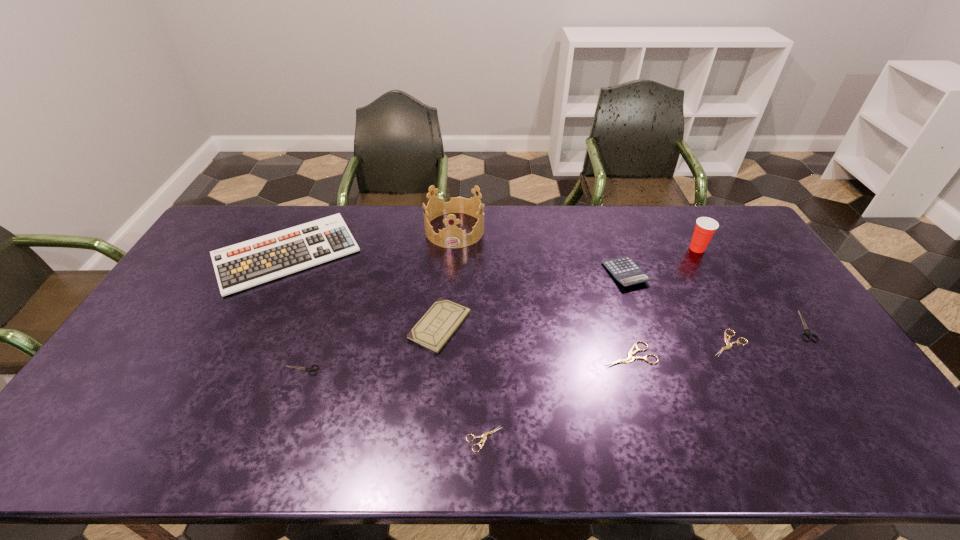
I want to click on the third shears from right to left, so click(630, 358).

The width and height of the screenshot is (960, 540). I want to click on the second shears from right to left, so click(729, 345).

Find the location of a particular element. Image resolution: width=960 pixels, height=540 pixels. the rightmost beige shears is located at coordinates (729, 345).

Locate an element on the screen. the smaller black shears is located at coordinates (309, 369).

Identify the location of the leftmost shears. (309, 369).

What are the coordinates of `the nearest object` in the screenshot? It's located at (484, 435).

I want to click on the second shears from left to right, so click(484, 435).

Where is `vacant space located 0.390m on the front-facing side of the tallest object`? This screenshot has width=960, height=540. vacant space located 0.390m on the front-facing side of the tallest object is located at coordinates (447, 335).

Locate an element on the screen. Image resolution: width=960 pixels, height=540 pixels. vacant space located on the front of the Dixie cup is located at coordinates (747, 336).

The height and width of the screenshot is (540, 960). What are the coordinates of `free space located 0.060m on the back of the computer keyboard` in the screenshot? It's located at (309, 212).